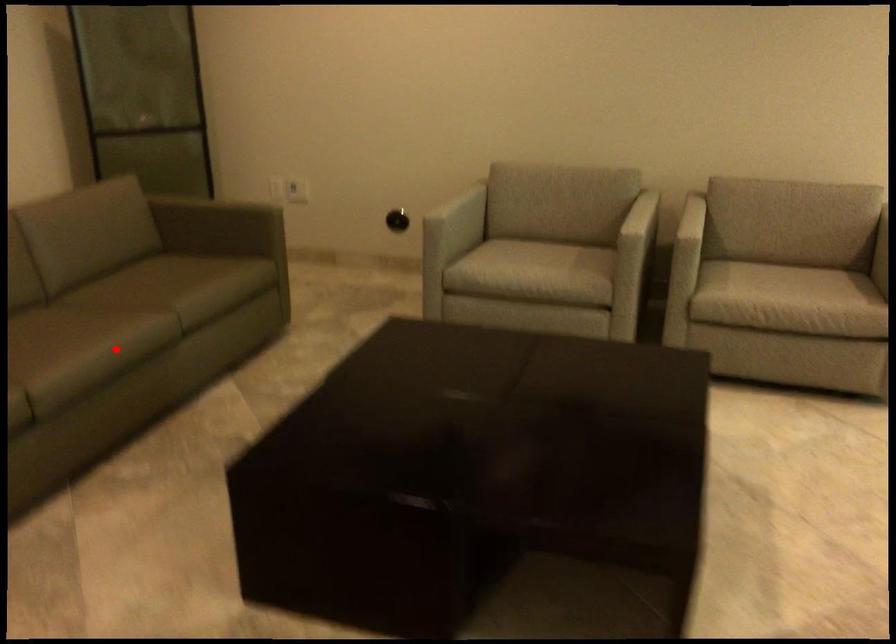
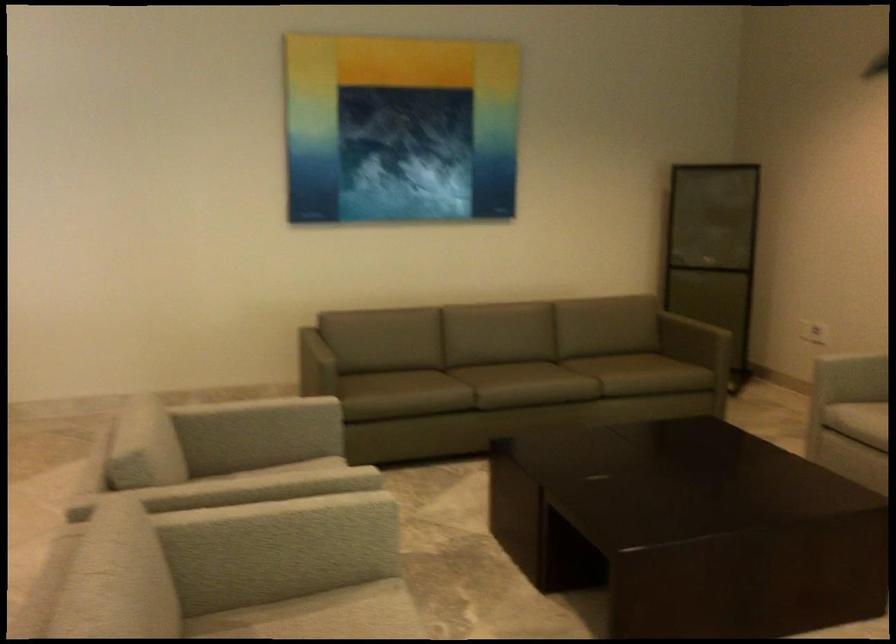
Question: I am providing you with two images of the same scene from different viewpoints. A red point is shown in image1. For the corresponding object point in image2, is it positioned nearer or farther from the camera?

Choices:
 (A) Nearer
 (B) Farther

Answer: (B)